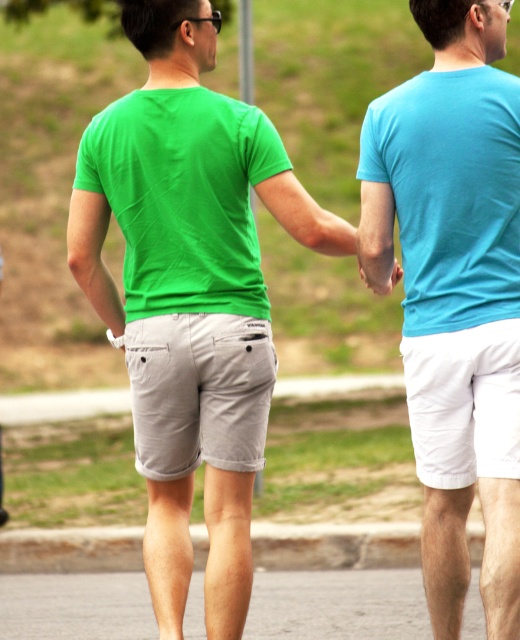
Measure the distance from matte blue t-shirt at center to matte skin hand at center.

The distance of matte blue t-shirt at center from matte skin hand at center is 22.38 inches.

Is matte blue t-shirt at center thinner than matte skin hand at center?

No.

Who is more forward, (447,163) or (391,236)?

Positioned in front is point (447,163).

Locate an element on the screen. The height and width of the screenshot is (640, 520). matte blue t-shirt at center is located at coordinates pyautogui.click(x=459, y=296).

Where is `matte green t-shirt at center`? matte green t-shirt at center is located at coordinates (192, 337).

Measure the distance between gray cotton shorts at center and matte skin hand at center.

95.52 centimeters

Does gray cotton shorts at center have a larger size compared to matte skin hand at center?

Yes, gray cotton shorts at center is bigger than matte skin hand at center.

Identify the location of gray cotton shorts at center. (199, 392).